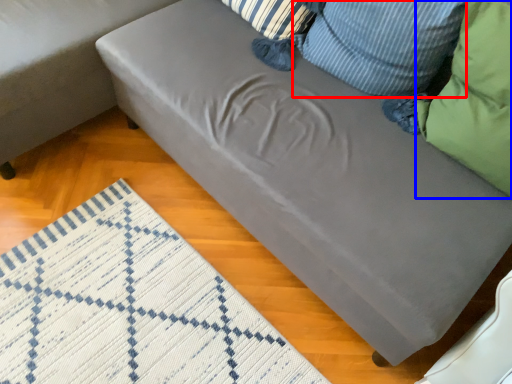
Question: Among these objects, which one is nearest to the camera, pillow (highlighted by a red box) or pillow (highlighted by a blue box)?

Choices:
 (A) pillow
 (B) pillow

Answer: (B)